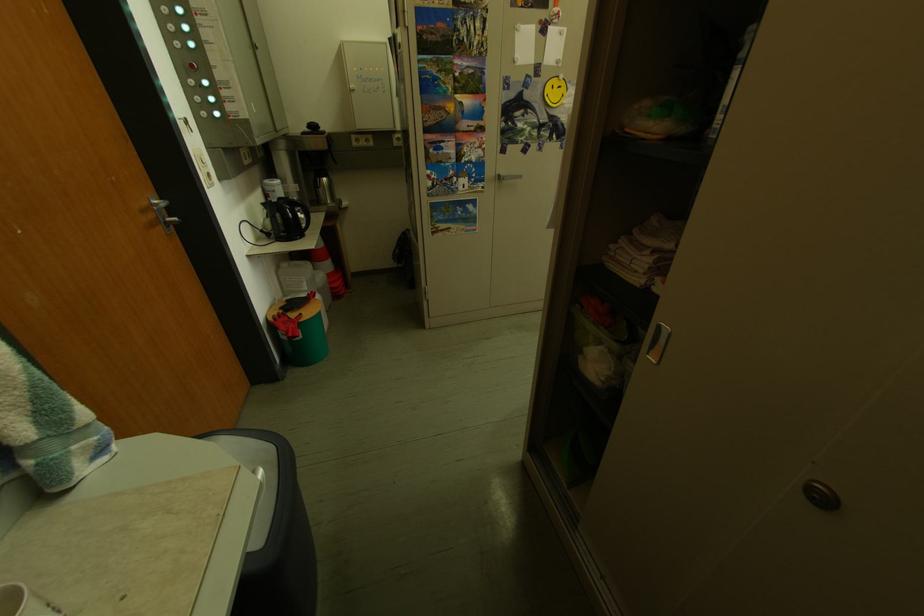
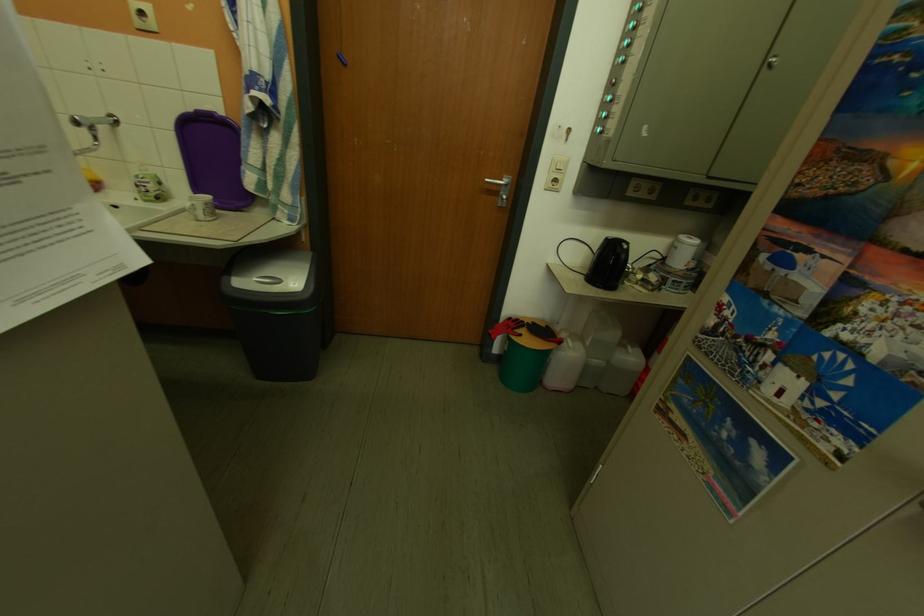
Where in the second image is the point corresponding to pixel 286 193 from the first image?

(689, 251)